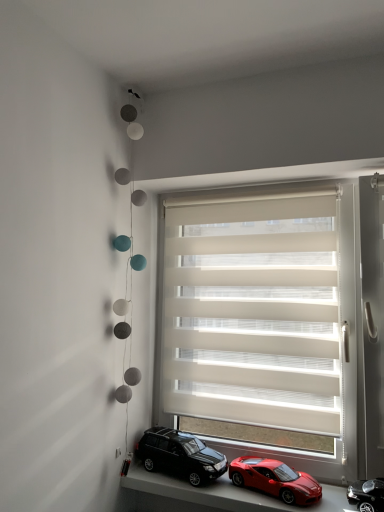
Question: From the image's perspective, is shiny black suv at lower center, the first car in the left-to-right sequence, positioned above or below smooth plastic toy cars at lower center?

Choices:
 (A) above
 (B) below

Answer: (A)

Question: From a real-world perspective, is shiny black suv at lower center, placed as the 3th car when sorted from right to left, positioned above or below smooth plastic toy cars at lower center?

Choices:
 (A) below
 (B) above

Answer: (B)

Question: Which object is the closest to the beige fabric window blind at center?

Choices:
 (A) smooth plastic toy cars at lower center
 (B) shiny red car at lower center, the 2th car in the left-to-right sequence
 (C) shiny black car at lower right, acting as the 3th car starting from the left
 (D) shiny black suv at lower center, the first car in the left-to-right sequence

Answer: (D)

Question: Which is nearer to the smooth plastic toy cars at lower center?

Choices:
 (A) beige fabric window blind at center
 (B) shiny black suv at lower center, placed as the 3th car when sorted from right to left
 (C) shiny red car at lower center, the 2th car in the left-to-right sequence
 (D) shiny black car at lower right, acting as the 1th car starting from the right

Answer: (B)